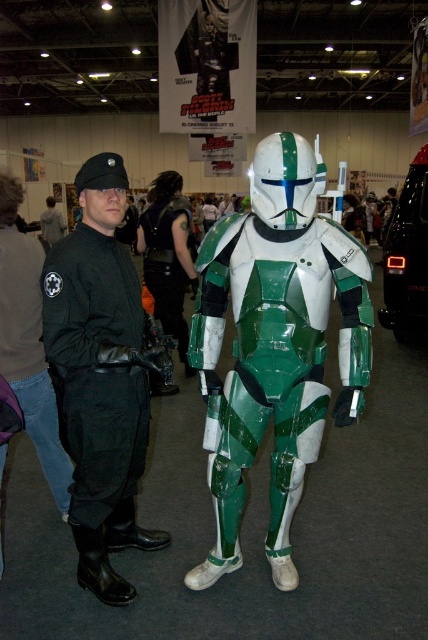
Question: Is black leather jacket at left smaller than black matte jacket at left?

Choices:
 (A) no
 (B) yes

Answer: (A)

Question: Which object appears farthest from the camera in this image?

Choices:
 (A) green matte armor at center
 (B) black matte jacket at left
 (C) black leather vest at center

Answer: (C)

Question: Which object is farther from the camera taking this photo?

Choices:
 (A) black leather vest at center
 (B) green matte armor at center

Answer: (A)

Question: Which point appears farthest from the camera in this image?

Choices:
 (A) (x=14, y=348)
 (B) (x=41, y=276)
 (C) (x=255, y=371)

Answer: (A)

Question: Does green matte armor at center lie behind black leather vest at center?

Choices:
 (A) no
 (B) yes

Answer: (A)

Question: Does black leather jacket at left appear on the left side of black leather vest at center?

Choices:
 (A) yes
 (B) no

Answer: (B)